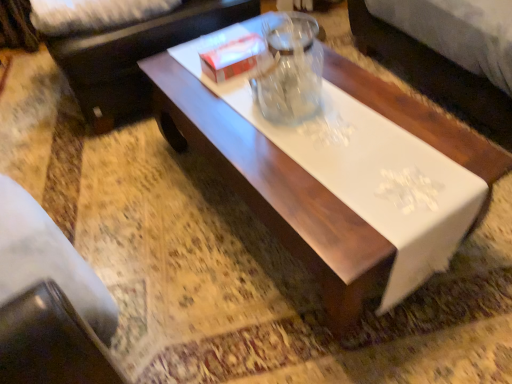
Question: From a real-world perspective, is dark brown leather couch at upper left located beneath white glossy coffee table at center?

Choices:
 (A) yes
 (B) no

Answer: (B)

Question: Is dark brown leather couch at upper left wider than white glossy coffee table at center?

Choices:
 (A) no
 (B) yes

Answer: (A)

Question: Could you tell me if dark brown leather couch at upper left is turned towards white glossy coffee table at center?

Choices:
 (A) no
 (B) yes

Answer: (B)

Question: From the image's perspective, does dark brown leather couch at upper left appear lower than white glossy coffee table at center?

Choices:
 (A) no
 (B) yes

Answer: (A)

Question: Considering the relative sizes of dark brown leather couch at upper left and white glossy coffee table at center in the image provided, is dark brown leather couch at upper left taller than white glossy coffee table at center?

Choices:
 (A) yes
 (B) no

Answer: (B)

Question: In terms of width, does white cardboard box at center look wider or thinner when compared to white glossy coffee table at center?

Choices:
 (A) wide
 (B) thin

Answer: (B)

Question: From the image's perspective, is white cardboard box at center located above or below white glossy coffee table at center?

Choices:
 (A) above
 (B) below

Answer: (A)

Question: Is white cardboard box at center taller or shorter than white glossy coffee table at center?

Choices:
 (A) tall
 (B) short

Answer: (B)

Question: From a real-world perspective, relative to white glossy coffee table at center, is white cardboard box at center vertically above or below?

Choices:
 (A) below
 (B) above

Answer: (B)

Question: Considering the positions of white glossy coffee table at center and white cardboard box at center in the image, is white glossy coffee table at center wider or thinner than white cardboard box at center?

Choices:
 (A) thin
 (B) wide

Answer: (B)

Question: From a real-world perspective, is white glossy coffee table at center above or below white cardboard box at center?

Choices:
 (A) above
 (B) below

Answer: (B)

Question: Is white glossy coffee table at center spatially inside white cardboard box at center, or outside of it?

Choices:
 (A) inside
 (B) outside

Answer: (B)

Question: Relative to white cardboard box at center, is white glossy coffee table at center in front or behind?

Choices:
 (A) behind
 (B) front

Answer: (B)

Question: Is white glossy coffee table at center taller or shorter than dark brown leather couch at upper left?

Choices:
 (A) tall
 (B) short

Answer: (A)

Question: Is white glossy coffee table at center wider or thinner than dark brown leather couch at upper left?

Choices:
 (A) thin
 (B) wide

Answer: (B)